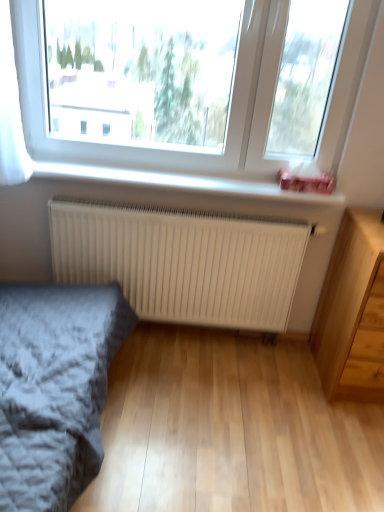
Question: Looking at the image, does transparent glass window at upper center seem bigger or smaller compared to white matte radiator at center?

Choices:
 (A) small
 (B) big

Answer: (B)

Question: In the image, is transparent glass window at upper center on the left side or the right side of white matte radiator at center?

Choices:
 (A) left
 (B) right

Answer: (B)

Question: Estimate the real-world distances between objects in this image. Which object is farther from the white plastic window sill at upper center?

Choices:
 (A) transparent glass window at upper center
 (B) gray textured bed at lower left
 (C) light wood chest of drawers at lower right
 (D) white matte radiator at center

Answer: (B)

Question: Which object is the farthest from the transparent glass window at upper center?

Choices:
 (A) gray textured bed at lower left
 (B) white plastic window sill at upper center
 (C) white matte radiator at center
 (D) light wood chest of drawers at lower right

Answer: (A)